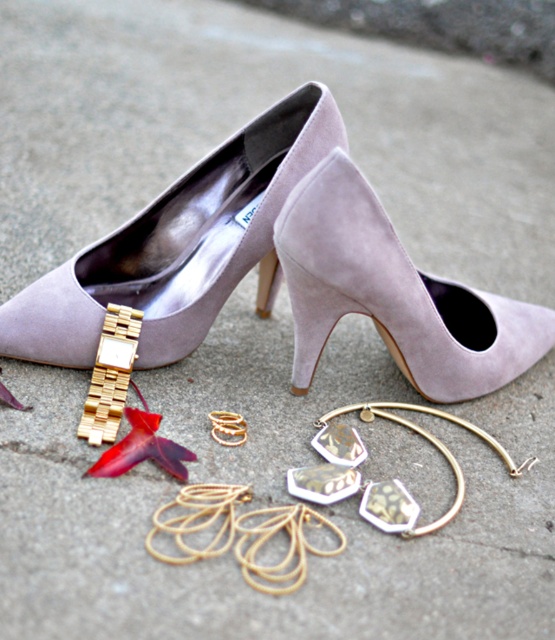
In the scene shown: You are standing at the origin of the coordinate system and looking at the image. There are two points marked in the image, point (337, 154) and point (108, 308). Which point is closer to you?

Point (337, 154) is in front of point (108, 308), so it is closer to you.

You are a photographer setting up a shoot for a fashion magazine. You need to ensure that the suede at upper center and the suede heel at center are both visible in the frame. Considering their heights, which object will appear larger in the photo?

The suede at upper center is much taller than the suede heel at center, so it will appear larger in the photo.